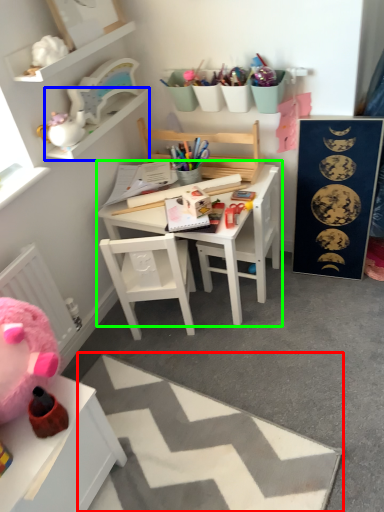
Question: Based on their relative distances, which object is nearer to plain (highlighted by a red box)? Choose from cabinet (highlighted by a blue box) and table (highlighted by a green box).

Choices:
 (A) cabinet
 (B) table

Answer: (B)